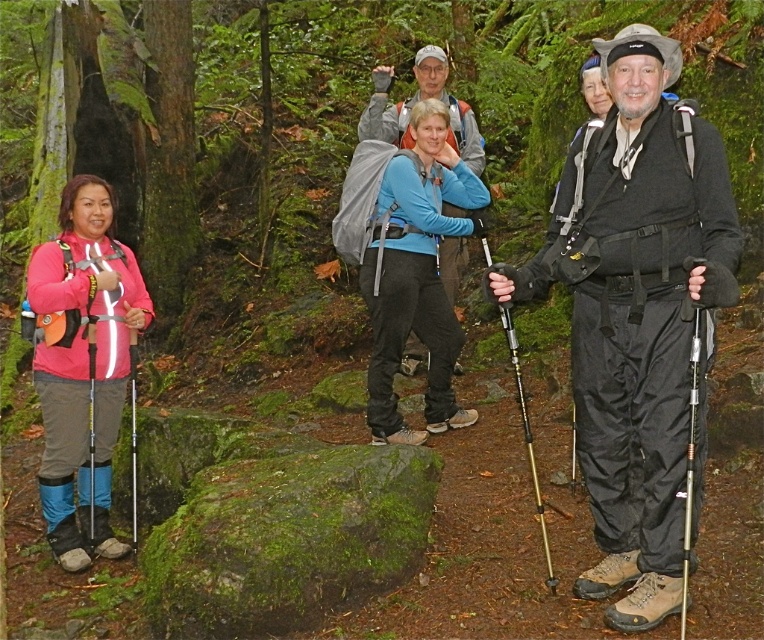
Is pink fabric jacket at left wider than black metallic pole at right?

Correct, the width of pink fabric jacket at left exceeds that of black metallic pole at right.

Can you confirm if pink fabric jacket at left is positioned to the right of black metallic pole at right?

Incorrect, pink fabric jacket at left is not on the right side of black metallic pole at right.

Locate an element on the screen. This screenshot has width=764, height=640. pink fabric jacket at left is located at coordinates [83, 365].

Does blue matte jacket at center have a greater width compared to yellow metallic ski pole at left?

Indeed, blue matte jacket at center has a greater width compared to yellow metallic ski pole at left.

Find the location of `blue matte jacket at center`. blue matte jacket at center is located at coordinates pyautogui.click(x=416, y=275).

This screenshot has height=640, width=764. In order to click on blue matte jacket at center in this screenshot , I will do `click(416, 275)`.

Describe the element at coordinates (690, 464) in the screenshot. The height and width of the screenshot is (640, 764). I see `silver metallic ski pole at right` at that location.

Does point (695, 396) come behind point (91, 518)?

No, (695, 396) is closer to viewer.

At what (x,y) coordinates should I click in order to perform the action: click on silver metallic ski pole at right. Please return your answer as a coordinate pair (x, y). Image resolution: width=764 pixels, height=640 pixels. Looking at the image, I should click on (690, 464).